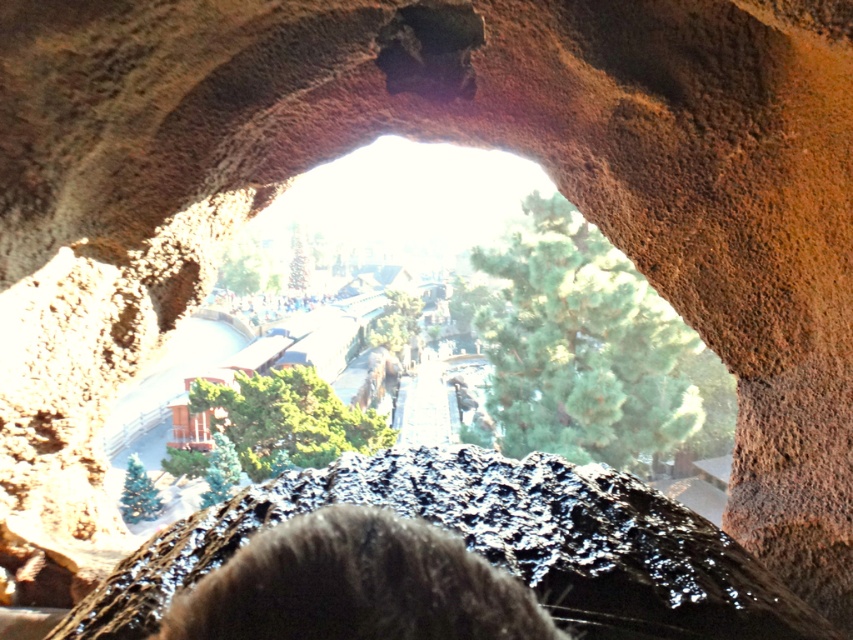
You are a geologist carrying a 1 meter long measuring tape. You want to measure the distance between yourself and the black matte coal at center. Can you accurately measure it with your tape?

The distance between you and the black matte coal at center is 1.05 meters. Since your tape is 1 meter long, it is not long enough to reach the coal. You need a longer tape.

You are a geologist examining the rock formation and notice two objects at the center of the image. Which object takes up more space, the black matte coal at center or the matte black crowd at center?

The matte black crowd at center occupies more space than the black matte coal at center.